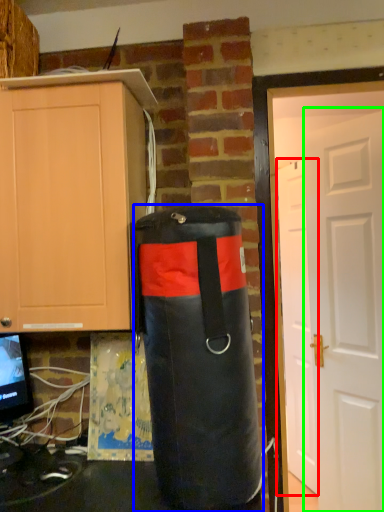
Question: Estimate the real-world distances between objects in this image. Which object is farther from door (highlighted by a red box), punching bag (highlighted by a blue box) or door (highlighted by a green box)?

Choices:
 (A) punching bag
 (B) door

Answer: (A)